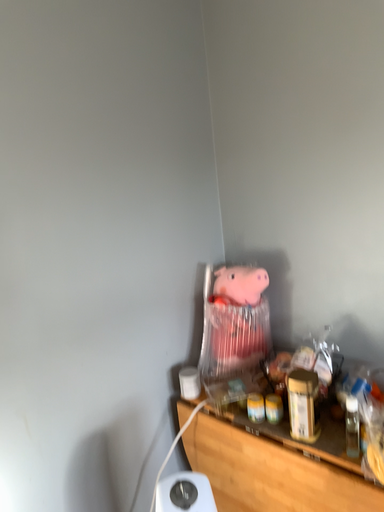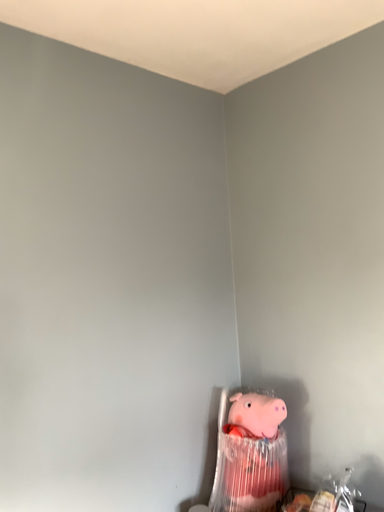
Question: How did the camera likely rotate when shooting the video?

Choices:
 (A) rotated downward
 (B) rotated upward

Answer: (B)